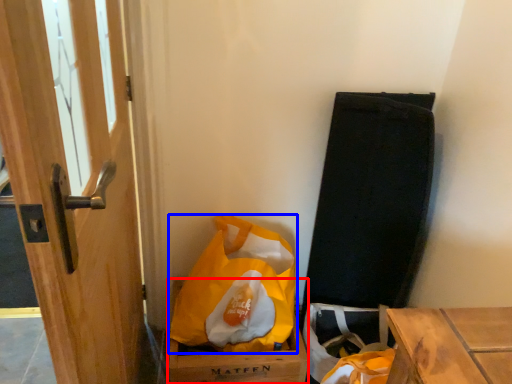
Question: Which point is closer to the camera, cardboard box (highlighted by a red box) or plastic bag (highlighted by a blue box)?

Choices:
 (A) cardboard box
 (B) plastic bag

Answer: (B)